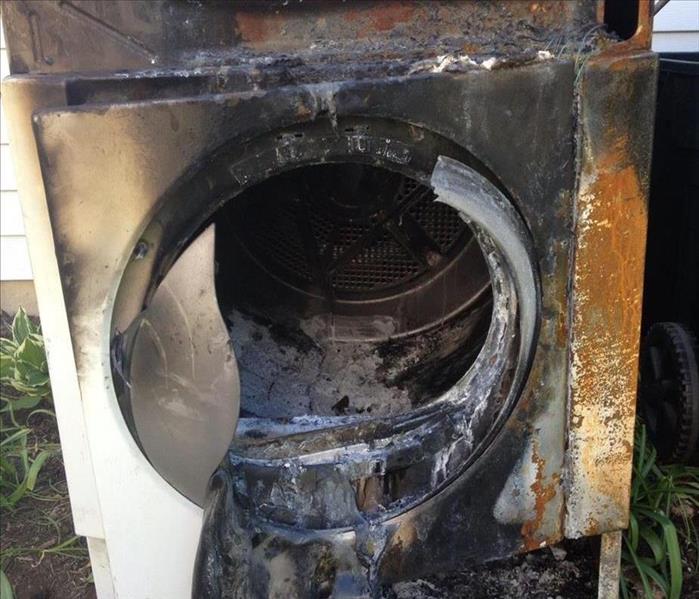
Find the location of a particular element. The image size is (699, 599). vent is located at coordinates (398, 263).